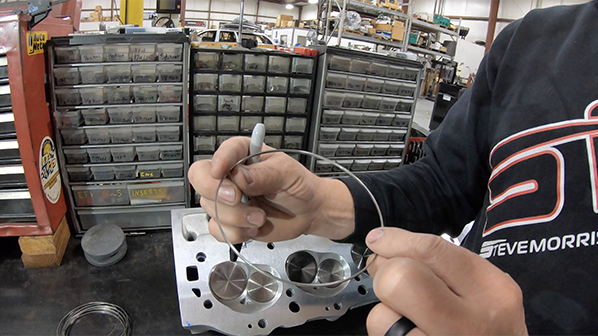
The image size is (598, 336). In order to click on part shelf in this screenshot , I will do `click(265, 83)`.